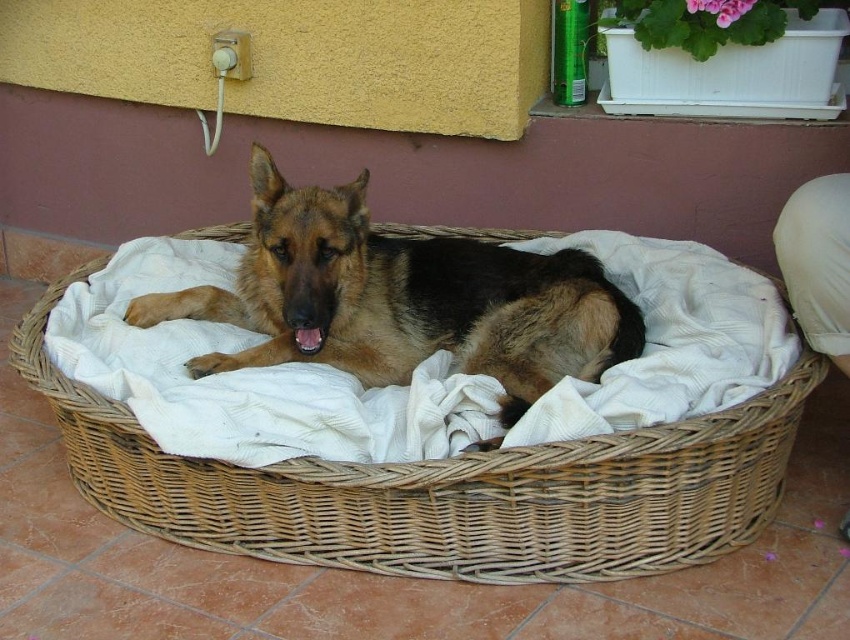
Does woven wicker basket at center appear under brown fur dog at center?

Yes.

Which is above, woven wicker basket at center or brown fur dog at center?

brown fur dog at center is above.

The width and height of the screenshot is (850, 640). What do you see at coordinates (443, 488) in the screenshot?
I see `woven wicker basket at center` at bounding box center [443, 488].

Where is `woven wicker basket at center`? The width and height of the screenshot is (850, 640). woven wicker basket at center is located at coordinates (443, 488).